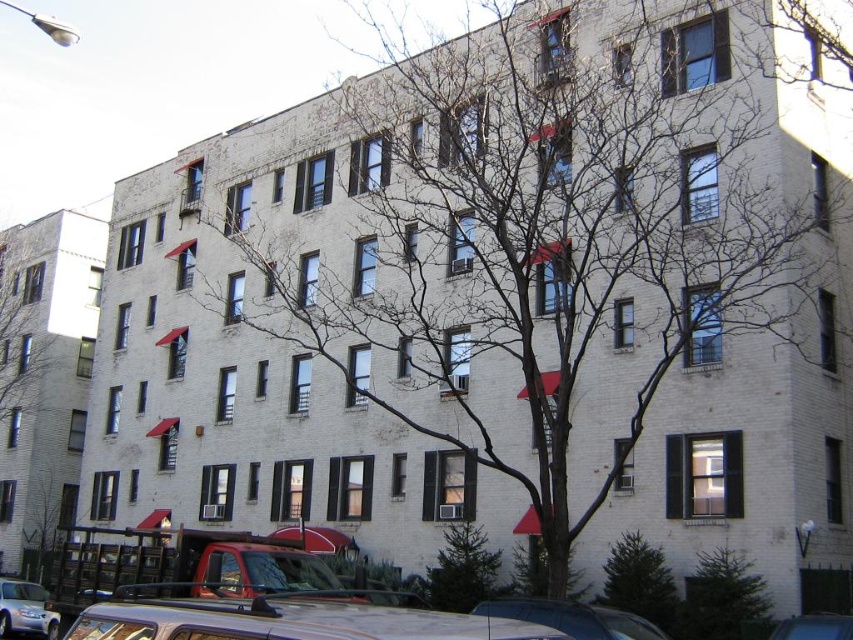
Question: Observing the image, what is the correct spatial positioning of white matte van at lower center in reference to green textured tree at lower right?

Choices:
 (A) above
 (B) below

Answer: (A)

Question: Among these points, which one is nearest to the camera?

Choices:
 (A) (33, 323)
 (B) (45, 632)
 (C) (445, 548)
 (D) (206, 634)

Answer: (D)

Question: Which point is farther from the camera taking this photo?

Choices:
 (A) [630, 604]
 (B) [427, 598]
 (C) [804, 621]

Answer: (B)

Question: Which point is closer to the camera?

Choices:
 (A) (811, 618)
 (B) (33, 240)
 (C) (660, 636)
 (D) (229, 632)

Answer: (D)

Question: Is bare branches at left positioned before green textured evergreen tree at lower center?

Choices:
 (A) no
 (B) yes

Answer: (A)

Question: Does green textured tree at lower right appear over green textured evergreen tree at lower center?

Choices:
 (A) no
 (B) yes

Answer: (B)